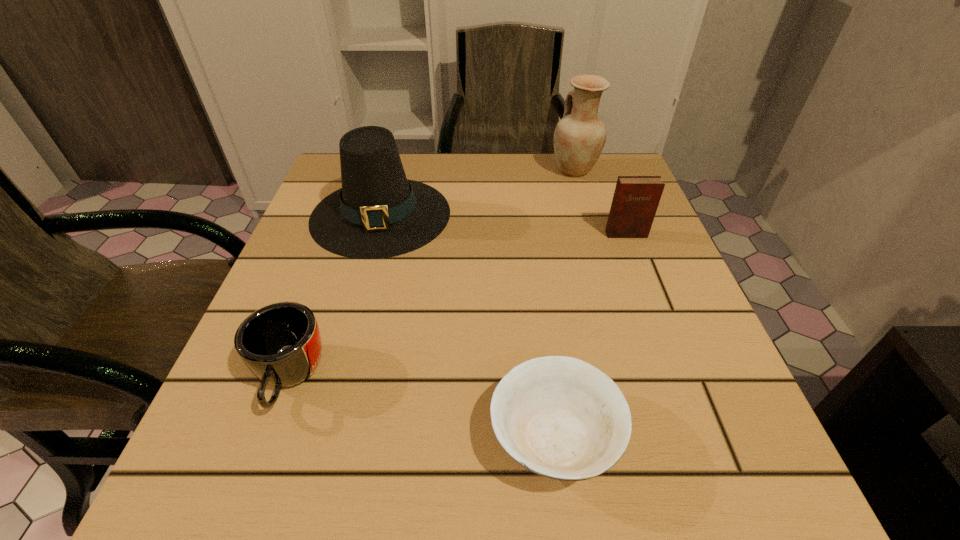
At what (x,y) coordinates should I click in order to perform the action: click on blank space at the near edge of the desktop. Please return your answer as a coordinate pair (x, y). This screenshot has width=960, height=540. Looking at the image, I should click on (349, 474).

The image size is (960, 540). Find the location of `free space at the left edge of the desktop`. free space at the left edge of the desktop is located at coordinates (356, 271).

Find the location of a particular element. The image size is (960, 540). free point at the right edge is located at coordinates (695, 340).

The width and height of the screenshot is (960, 540). In the image, there is a desktop. In order to click on vacant space at the far left corner in this screenshot , I will do `click(340, 168)`.

Identify the location of free region at the far right corner. (603, 194).

The image size is (960, 540). In the image, there is a desktop. Find the location of `free space at the near right corner`. free space at the near right corner is located at coordinates (657, 484).

Where is `free space between the second shortest object and the pottery`? This screenshot has height=540, width=960. free space between the second shortest object and the pottery is located at coordinates (432, 273).

I want to click on vacant space that's between the third shortest object and the second shortest object, so click(x=458, y=305).

Locate an element on the screen. The width and height of the screenshot is (960, 540). vacant area that lies between the shortest object and the hat is located at coordinates (468, 325).

At what (x,y) coordinates should I click in order to perform the action: click on vacant area that lies between the tallest object and the third shortest object. Please return your answer as a coordinate pair (x, y). Looking at the image, I should click on (600, 202).